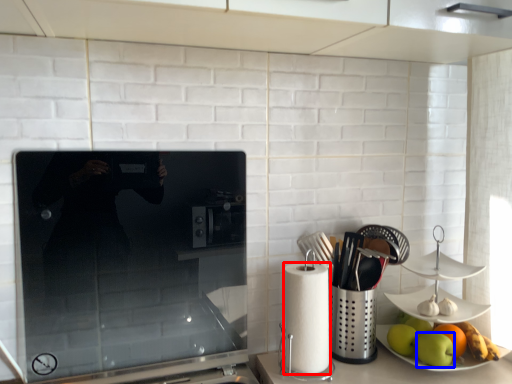
Question: Which point is closer to the camera, paper towel (highlighted by a red box) or apple (highlighted by a blue box)?

Choices:
 (A) paper towel
 (B) apple

Answer: (A)